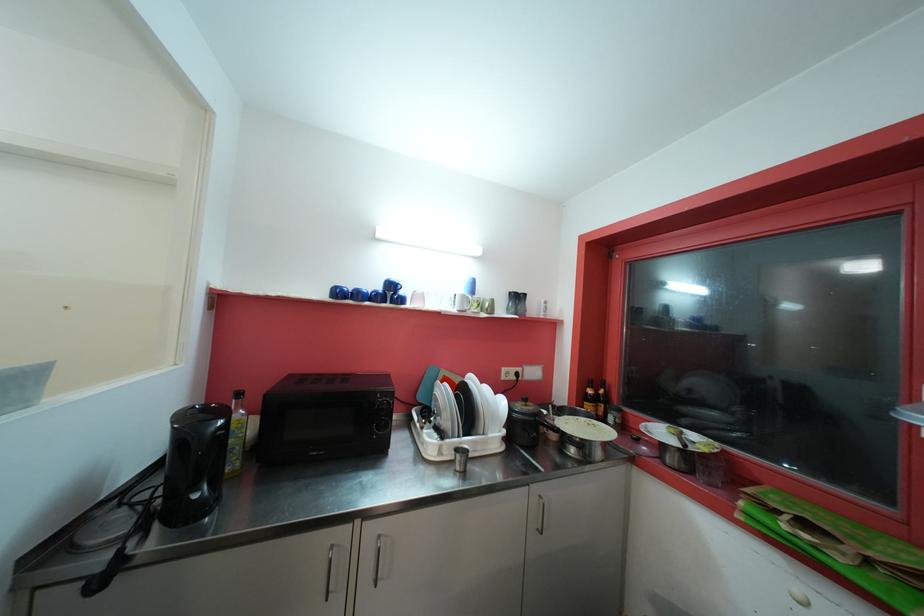
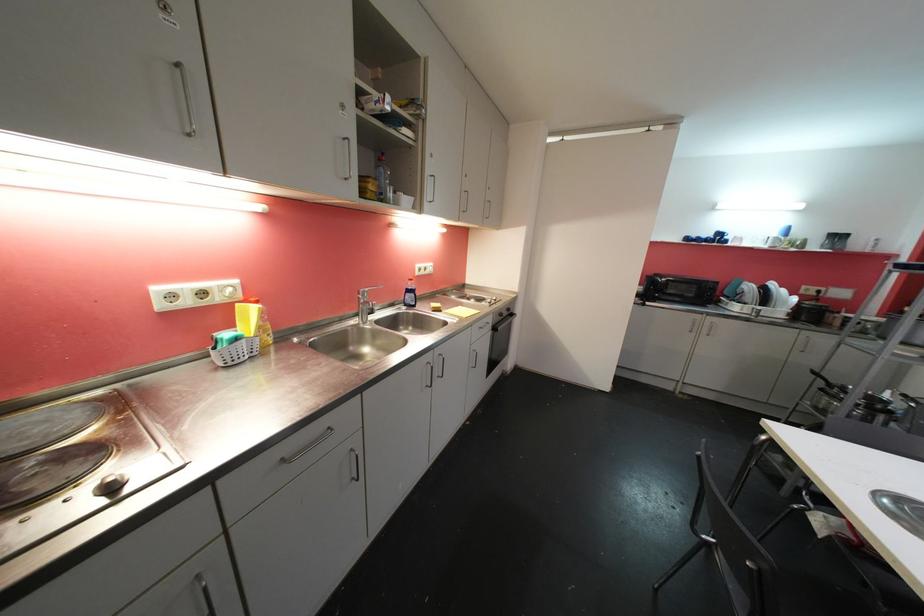
Find the pixel in the second image that matches point (467, 292) in the first image.

(781, 236)